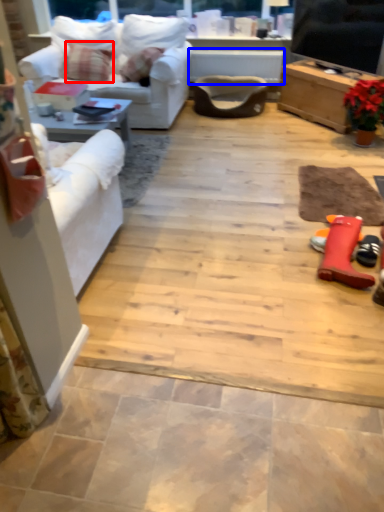
Question: Which object is further to the camera taking this photo, pillow (highlighted by a red box) or table (highlighted by a blue box)?

Choices:
 (A) pillow
 (B) table

Answer: (B)